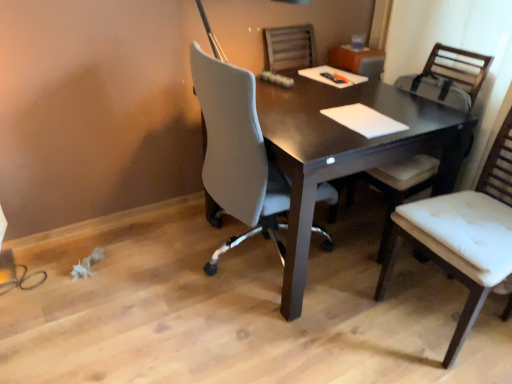
This screenshot has width=512, height=384. I want to click on vacant area situated below white leather chair at right, which is the 1th chair in front-to-back order (from a real-world perspective), so click(x=446, y=312).